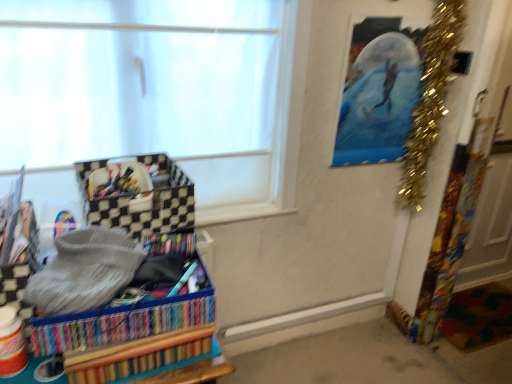
Locate an element on the screen. This screenshot has width=512, height=384. metallic blue painting at upper right is located at coordinates (378, 91).

The width and height of the screenshot is (512, 384). Identify the location of multicolored woven basket at lower left, placed as the second storage box when sorted from top to bottom. (125, 319).

Identify the location of gold tinsel garland at upper right. The height and width of the screenshot is (384, 512). (430, 98).

Considering the relative sizes of metallic blue painting at upper right and gold tinsel garland at upper right in the image provided, is metallic blue painting at upper right smaller than gold tinsel garland at upper right?

Yes.

Which is more to the right, metallic blue painting at upper right or gold tinsel garland at upper right?

From the viewer's perspective, gold tinsel garland at upper right appears more on the right side.

Which point is more distant from viewer, (381, 151) or (437, 84)?

The point (381, 151) is behind.

Considering the points (349, 164) and (120, 214), which point is in front, point (349, 164) or point (120, 214)?

The point (120, 214) is closer.

Is metallic blue painting at upper right taller or shorter than black checkered storage box at left, which appears as the first storage box when viewed from the top?

Clearly, metallic blue painting at upper right is taller compared to black checkered storage box at left, which appears as the first storage box when viewed from the top.

Could you tell me if metallic blue painting at upper right is turned towards black checkered storage box at left, the second storage box when ordered from bottom to top?

No, metallic blue painting at upper right is not oriented towards black checkered storage box at left, the second storage box when ordered from bottom to top.

Does metallic blue painting at upper right come behind black checkered storage box at left, the second storage box when ordered from bottom to top?

That is True.

Is white matte window at upper left behind multicolored woven basket at lower left, acting as the 1th storage box starting from the bottom?

Yes, the depth of white matte window at upper left is greater than that of multicolored woven basket at lower left, acting as the 1th storage box starting from the bottom.

Can you confirm if white matte window at upper left is shorter than multicolored woven basket at lower left, acting as the 1th storage box starting from the bottom?

No, white matte window at upper left is not shorter than multicolored woven basket at lower left, acting as the 1th storage box starting from the bottom.

The image size is (512, 384). In order to click on the 2nd storage box below when counting from the white matte window at upper left (from the image's perspective) in this screenshot , I will do `click(125, 319)`.

Consider the image. Does gold tinsel garland at upper right have a lesser height compared to multicolored woven basket at lower left, acting as the 1th storage box starting from the bottom?

No.

Does gold tinsel garland at upper right turn towards multicolored woven basket at lower left, placed as the second storage box when sorted from top to bottom?

No.

Which object is positioned more to the right, gold tinsel garland at upper right or multicolored woven basket at lower left, placed as the second storage box when sorted from top to bottom?

gold tinsel garland at upper right.

Does gold tinsel garland at upper right have a larger size compared to multicolored woven basket at lower left, placed as the second storage box when sorted from top to bottom?

Yes, gold tinsel garland at upper right is bigger than multicolored woven basket at lower left, placed as the second storage box when sorted from top to bottom.

How distant is metallic blue painting at upper right from multicolored woven basket at lower left, acting as the 1th storage box starting from the bottom?

A distance of 3.68 feet exists between metallic blue painting at upper right and multicolored woven basket at lower left, acting as the 1th storage box starting from the bottom.

Find the location of a particular element. The width and height of the screenshot is (512, 384). picture frame behind the multicolored woven basket at lower left, placed as the second storage box when sorted from top to bottom is located at coordinates (378, 91).

Considering the relative sizes of metallic blue painting at upper right and multicolored woven basket at lower left, placed as the second storage box when sorted from top to bottom, in the image provided, is metallic blue painting at upper right thinner than multicolored woven basket at lower left, placed as the second storage box when sorted from top to bottom,?

Correct, the width of metallic blue painting at upper right is less than that of multicolored woven basket at lower left, placed as the second storage box when sorted from top to bottom.

Can you tell me how much metallic blue painting at upper right and multicolored woven basket at lower left, placed as the second storage box when sorted from top to bottom, differ in facing direction?

3.47 degrees separate the facing orientations of metallic blue painting at upper right and multicolored woven basket at lower left, placed as the second storage box when sorted from top to bottom.

From the image's perspective, which one is positioned higher, multicolored woven basket at lower left, placed as the second storage box when sorted from top to bottom, or black checkered storage box at left, the second storage box when ordered from bottom to top?

black checkered storage box at left, the second storage box when ordered from bottom to top, is shown above in the image.

Are multicolored woven basket at lower left, placed as the second storage box when sorted from top to bottom, and black checkered storage box at left, which appears as the first storage box when viewed from the top, far apart?

No.

Consider the image. Can you tell me how much multicolored woven basket at lower left, acting as the 1th storage box starting from the bottom, and black checkered storage box at left, the second storage box when ordered from bottom to top, differ in facing direction?

The angular difference between multicolored woven basket at lower left, acting as the 1th storage box starting from the bottom, and black checkered storage box at left, the second storage box when ordered from bottom to top, is 9.01 degrees.

Is gold tinsel garland at upper right inside black checkered storage box at left, which appears as the first storage box when viewed from the top?

No.

Which of these two, black checkered storage box at left, which appears as the first storage box when viewed from the top, or gold tinsel garland at upper right, is smaller?

With smaller size is black checkered storage box at left, which appears as the first storage box when viewed from the top.

In the scene shown: From a real-world perspective, is black checkered storage box at left, which appears as the first storage box when viewed from the top, below gold tinsel garland at upper right?

Yes, from a real-world perspective, black checkered storage box at left, which appears as the first storage box when viewed from the top, is under gold tinsel garland at upper right.

Identify the location of picture frame located above the gold tinsel garland at upper right (from the image's perspective). (378, 91).

Where is `the 2nd storage box counting from the left of the metallic blue painting at upper right`? the 2nd storage box counting from the left of the metallic blue painting at upper right is located at coordinates (137, 194).

Which object lies nearer to the anchor point multicolored woven basket at lower left, placed as the second storage box when sorted from top to bottom, metallic blue painting at upper right or black checkered storage box at left, which appears as the first storage box when viewed from the top?

The object closer to multicolored woven basket at lower left, placed as the second storage box when sorted from top to bottom, is black checkered storage box at left, which appears as the first storage box when viewed from the top.

Which object lies nearer to the anchor point gold tinsel garland at upper right, metallic blue painting at upper right or multicolored woven basket at lower left, placed as the second storage box when sorted from top to bottom?

metallic blue painting at upper right.

Considering their positions, is multicolored woven basket at lower left, placed as the second storage box when sorted from top to bottom, positioned further to gold tinsel garland at upper right than white matte window at upper left?

multicolored woven basket at lower left, placed as the second storage box when sorted from top to bottom, is further to gold tinsel garland at upper right.

Which object lies further to the anchor point multicolored woven basket at lower left, acting as the 1th storage box starting from the bottom, gold tinsel garland at upper right or black checkered storage box at left, the second storage box when ordered from bottom to top?

gold tinsel garland at upper right is positioned further to the anchor multicolored woven basket at lower left, acting as the 1th storage box starting from the bottom.

Which object lies further to the anchor point gold tinsel garland at upper right, multicolored woven basket at lower left, acting as the 1th storage box starting from the bottom, or metallic blue painting at upper right?

multicolored woven basket at lower left, acting as the 1th storage box starting from the bottom, is further to gold tinsel garland at upper right.

Estimate the real-world distances between objects in this image. Which object is further from white matte window at upper left, black checkered storage box at left, the second storage box when ordered from bottom to top, or gold tinsel garland at upper right?

The object further to white matte window at upper left is gold tinsel garland at upper right.

Based on their spatial positions, is gold tinsel garland at upper right or multicolored woven basket at lower left, placed as the second storage box when sorted from top to bottom, closer to metallic blue painting at upper right?

gold tinsel garland at upper right is positioned closer to the anchor metallic blue painting at upper right.

Looking at this image, which object lies nearer to the anchor point metallic blue painting at upper right, multicolored woven basket at lower left, placed as the second storage box when sorted from top to bottom, or white matte window at upper left?

white matte window at upper left is positioned closer to the anchor metallic blue painting at upper right.

What are the coordinates of `window situated between multicolored woven basket at lower left, acting as the 1th storage box starting from the bottom, and gold tinsel garland at upper right from left to right` in the screenshot? It's located at (160, 92).

Identify the location of window situated between multicolored woven basket at lower left, placed as the second storage box when sorted from top to bottom, and metallic blue painting at upper right from left to right. (160, 92).

I want to click on storage box between black checkered storage box at left, the second storage box when ordered from bottom to top, and gold tinsel garland at upper right, in the horizontal direction, so click(125, 319).

In order to click on window situated between black checkered storage box at left, the second storage box when ordered from bottom to top, and gold tinsel garland at upper right from left to right in this screenshot , I will do `click(160, 92)`.